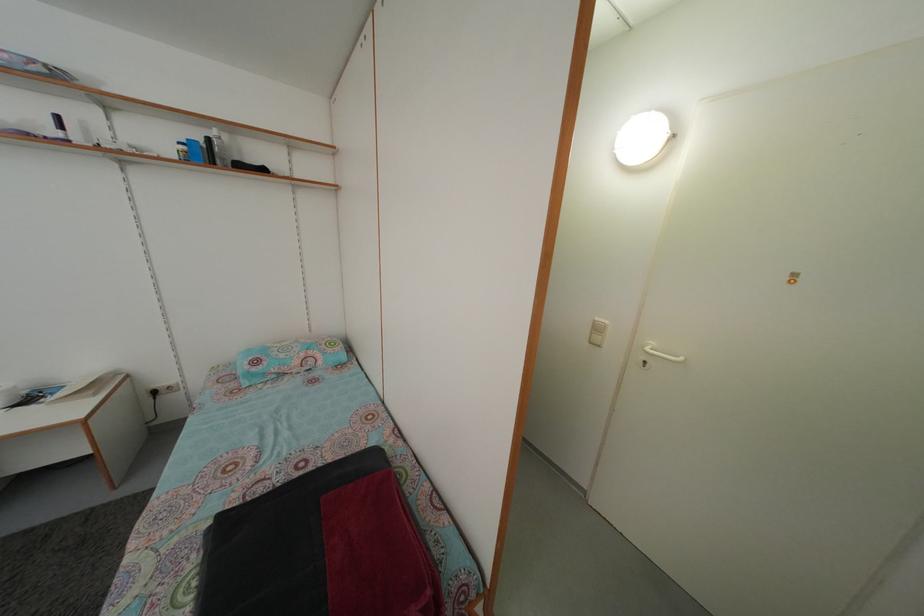
The height and width of the screenshot is (616, 924). Describe the element at coordinates (662, 354) in the screenshot. I see `the white door handle` at that location.